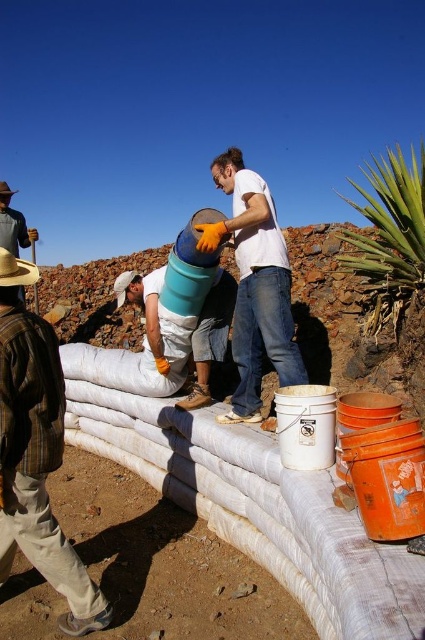
Question: Among these points, which one is farthest from the camera?

Choices:
 (A) (283, 304)
 (B) (84, 588)
 (C) (150, 310)

Answer: (C)

Question: Does white matte shirt at center have a greater width compared to matte blue bucket at center?

Choices:
 (A) yes
 (B) no

Answer: (B)

Question: Is the position of brown plaid shirt at left less distant than that of matte blue bucket at center?

Choices:
 (A) yes
 (B) no

Answer: (A)

Question: Which object appears closest to the camera in this image?

Choices:
 (A) matte blue bucket at center
 (B) white matte shirt at center

Answer: (B)

Question: Is brown plaid shirt at left to the right of matte blue bucket at center from the viewer's perspective?

Choices:
 (A) no
 (B) yes

Answer: (A)

Question: Which point is farther to the camera?

Choices:
 (A) (240, 298)
 (B) (0, 292)
 (C) (170, 372)

Answer: (C)